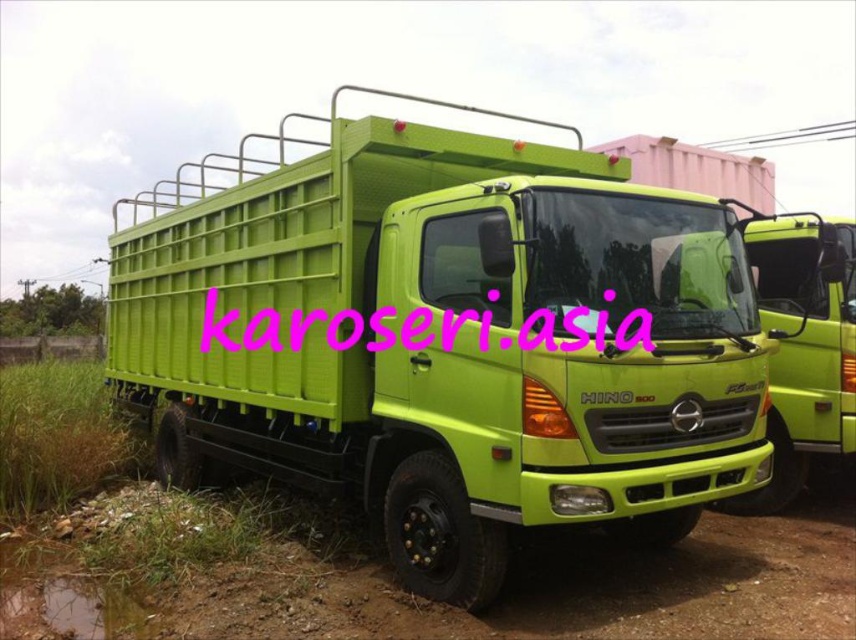
You are a toy collector who wants to display the lime green plastic truck at center on a shelf. The shelf has a small gap between two other items. The gap is exactly the width of the green matte dirt track at lower left. Can the truck fit into the gap? Explain your reasoning.

The lime green plastic truck at center is positioned over green matte dirt track at lower left, meaning the truck is wider than the dirt track. Since the gap on the shelf is the same width as the dirt track, the truck cannot fit into the gap because it is wider than the available space.

Consider the image. You are a delivery driver who needs to move the lime green plastic truck at center to the green matte dirt track at lower left. The truck has a 3.5 meter turning radius. Can you maneuver the truck onto the track without hitting any obstacles?

The lime green plastic truck at center is 3.83 meters away from the green matte dirt track at lower left. Since the truck requires a 3.5 meter turning radius, there is sufficient space to maneuver the truck onto the track without hitting obstacles.

You are a toy collector who wants to display your lime green plastic truck at center on a shelf next to a miniature green matte dirt track at lower left. Which object should be placed higher on the shelf to ensure proper visibility of both items?

The lime green plastic truck at center is taller than the green matte dirt track at lower left, so it should be placed higher on the shelf to ensure proper visibility of both items.